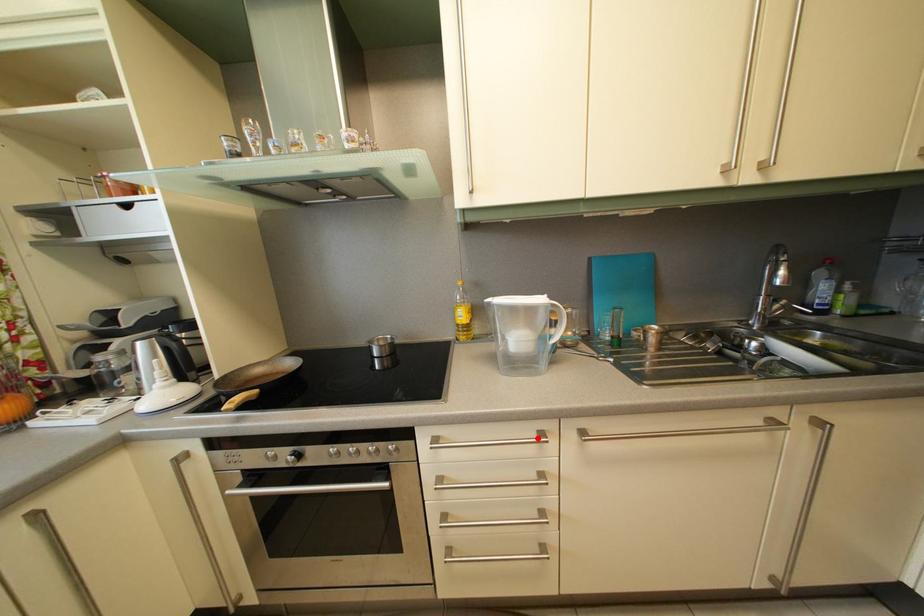
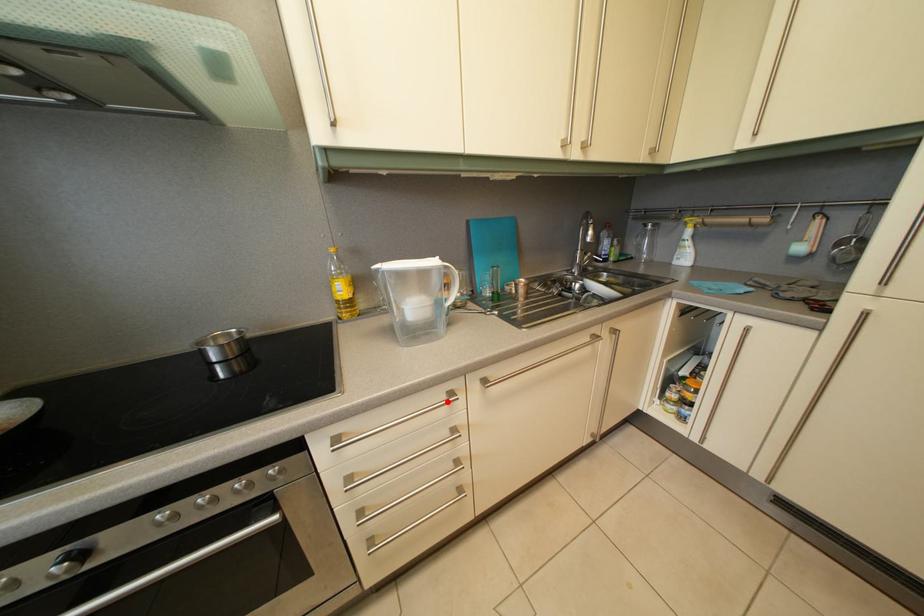
I am providing you with two images of the same scene from different viewpoints. A red point is marked on the first image and another point is marked on the second image. Does the point marked in image1 correspond to the same location as the one in image2?

Yes